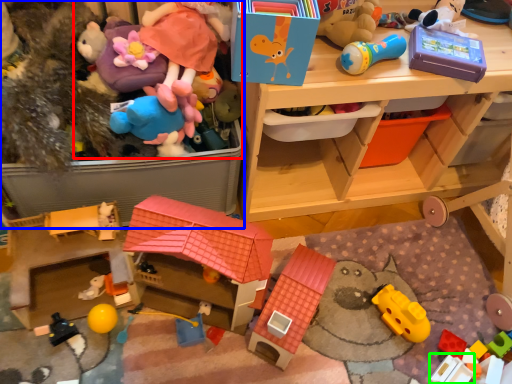
Question: Based on their relative distances, which object is farther from toy (highlighted by a red box)? Choose from toy (highlighted by a blue box) and toy (highlighted by a green box).

Choices:
 (A) toy
 (B) toy

Answer: (B)